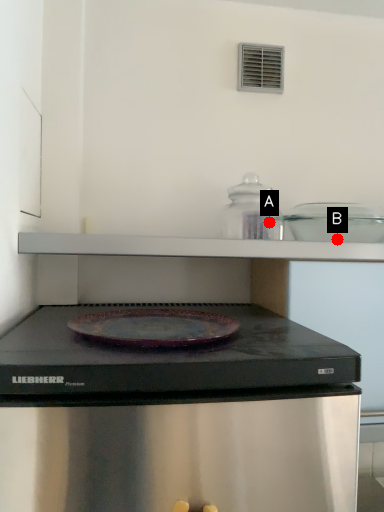
Question: Two points are circled on the image, labeled by A and B beside each circle. Which point appears farthest from the camera in this image?

Choices:
 (A) A is further
 (B) B is further

Answer: (B)